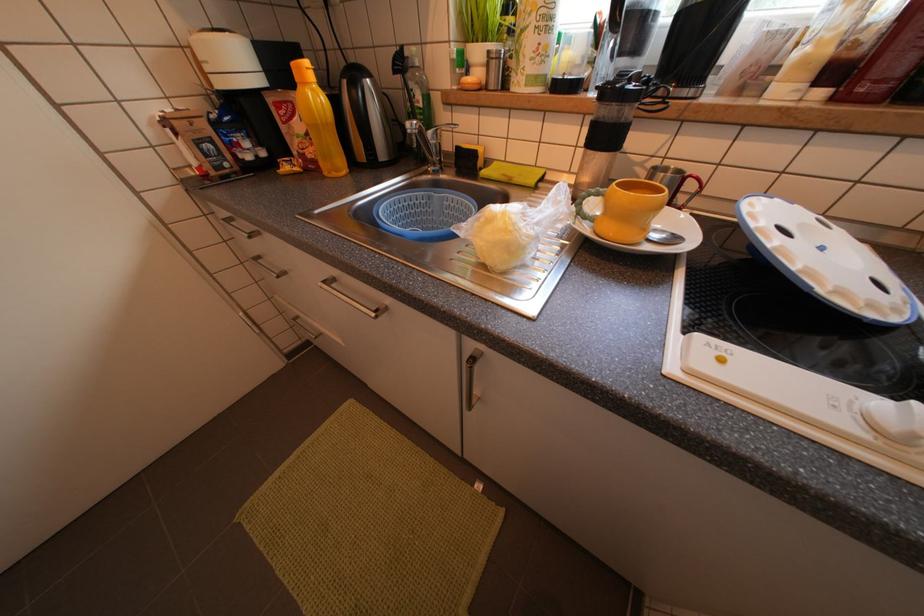
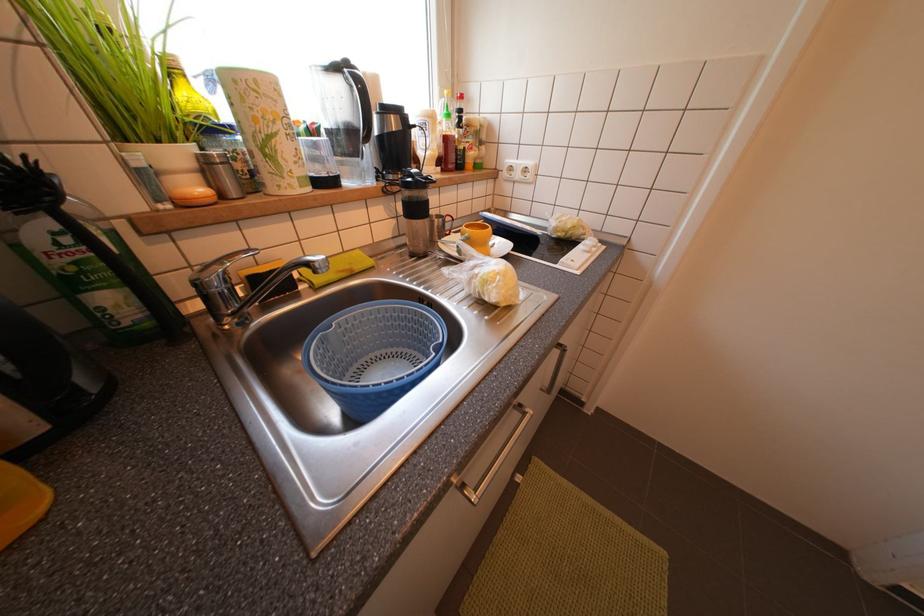
The images are taken continuously from a first-person perspective. In which direction is your viewpoint rotating?

The camera's rotation is toward right-down.